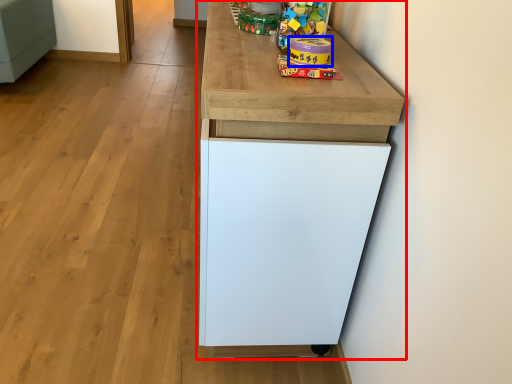
Question: Among these objects, which one is farthest to the camera, cabinetry (highlighted by a red box) or toy (highlighted by a blue box)?

Choices:
 (A) cabinetry
 (B) toy

Answer: (B)